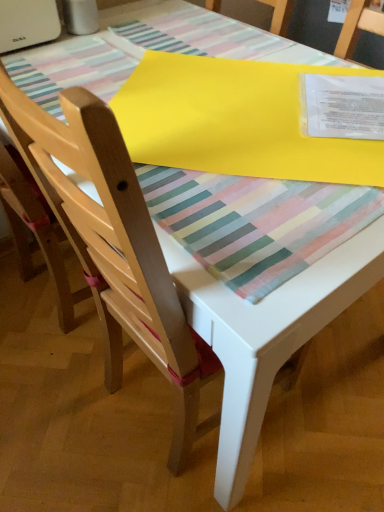
This screenshot has width=384, height=512. I want to click on unoccupied area in front of light wood chair at left, which is counted as the first chair, starting from the left, so click(x=51, y=369).